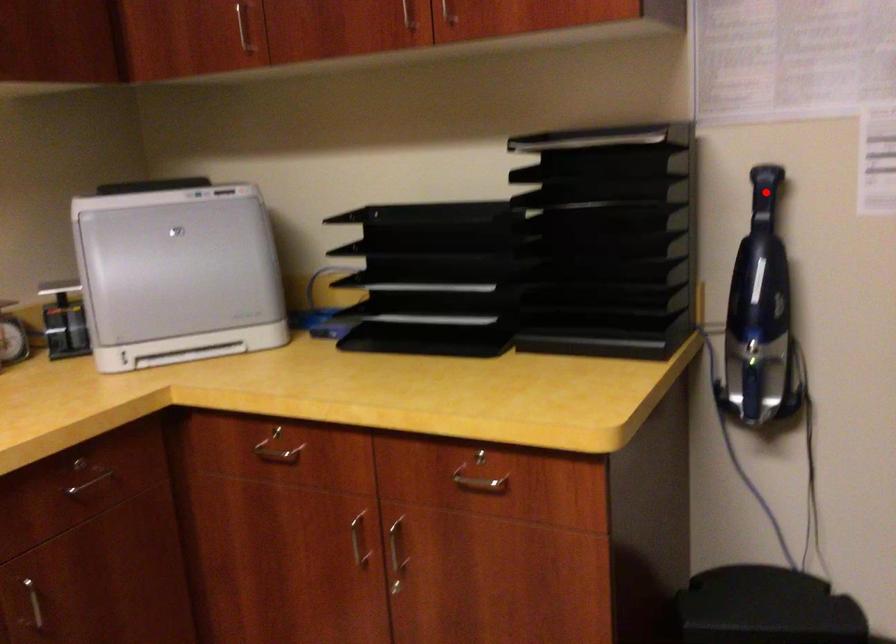
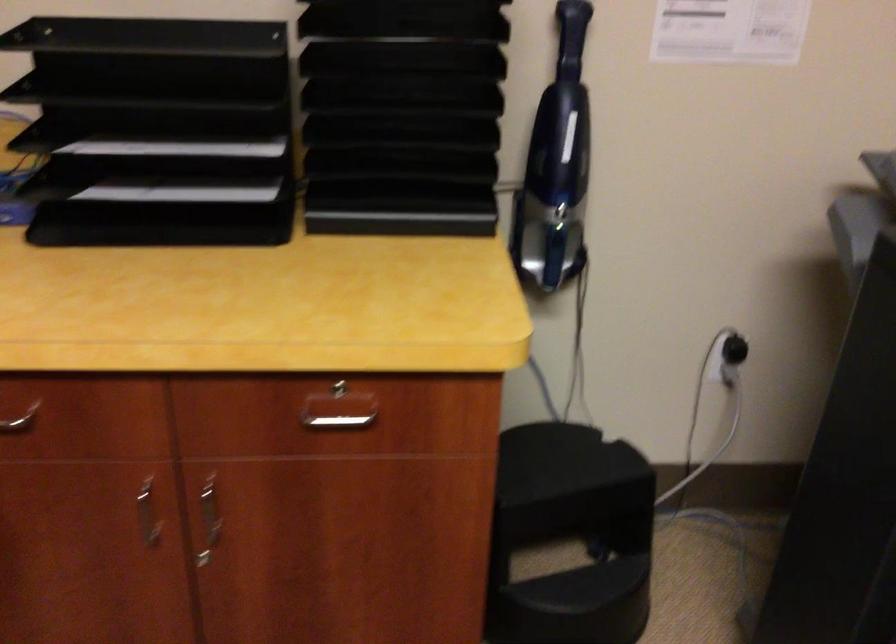
Question: I am providing you with two images of the same scene from different viewpoints. A red point is shown in image1. For the corresponding object point in image2, is it positioned nearer or farther from the camera?

Choices:
 (A) Nearer
 (B) Farther

Answer: (A)